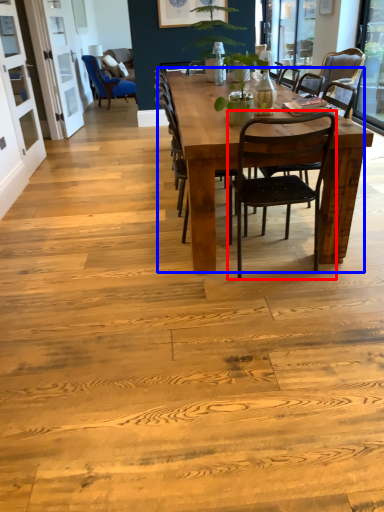
Question: Among these objects, which one is nearest to the camera, chair (highlighted by a red box) or kitchen & dining room table (highlighted by a blue box)?

Choices:
 (A) chair
 (B) kitchen & dining room table

Answer: (A)